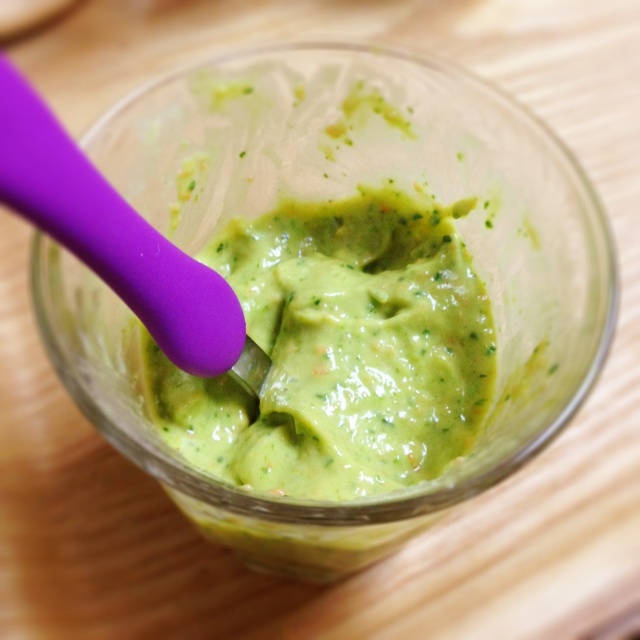
Question: Is the position of green creamy guacamole at center less distant than that of purple silicone spoon at center?

Choices:
 (A) yes
 (B) no

Answer: (B)

Question: Which point is farther from the camera taking this photo?

Choices:
 (A) (209, 339)
 (B) (410, 259)

Answer: (B)

Question: From the image, what is the correct spatial relationship of green creamy guacamole at center in relation to purple silicone spoon at center?

Choices:
 (A) right
 (B) left

Answer: (A)

Question: Which point appears farthest from the camera in this image?

Choices:
 (A) (301, 307)
 (B) (93, 209)

Answer: (A)

Question: Is green creamy guacamole at center positioned in front of purple silicone spoon at center?

Choices:
 (A) yes
 (B) no

Answer: (B)

Question: Which of the following is the closest to the observer?

Choices:
 (A) (106, 256)
 (B) (252, 442)

Answer: (A)